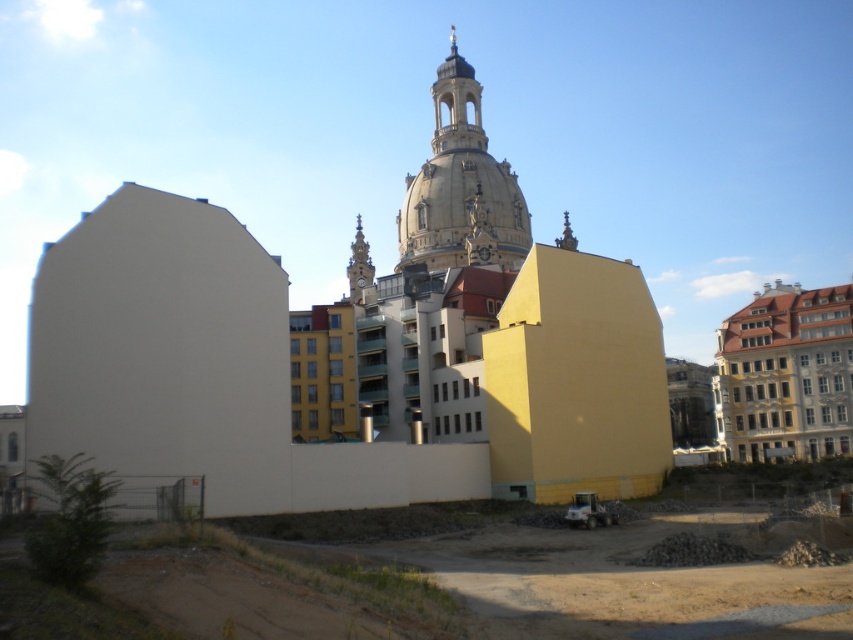
Does point (125, 330) come farther from viewer compared to point (805, 416)?

No, it is not.

Does point (471, 284) come in front of point (746, 323)?

Yes, point (471, 284) is in front of point (746, 323).

Where is `smooth stone church at center`? This screenshot has width=853, height=640. smooth stone church at center is located at coordinates (352, 353).

Image resolution: width=853 pixels, height=640 pixels. I want to click on smooth stone church at center, so click(x=352, y=353).

Can you confirm if smooth stone church at center is wider than smooth concrete ground at lower center?

No, smooth stone church at center is not wider than smooth concrete ground at lower center.

Is smooth stone church at center thinner than smooth concrete ground at lower center?

Indeed, smooth stone church at center has a lesser width compared to smooth concrete ground at lower center.

Which is in front, point (492, 161) or point (799, 614)?

Point (799, 614)

At what (x,y) coordinates should I click in order to perform the action: click on smooth stone church at center. Please return your answer as a coordinate pair (x, y). Image resolution: width=853 pixels, height=640 pixels. Looking at the image, I should click on [352, 353].

Is point (225, 394) farther from camera compared to point (480, 257)?

That is False.

I want to click on smooth stone church at center, so point(352,353).